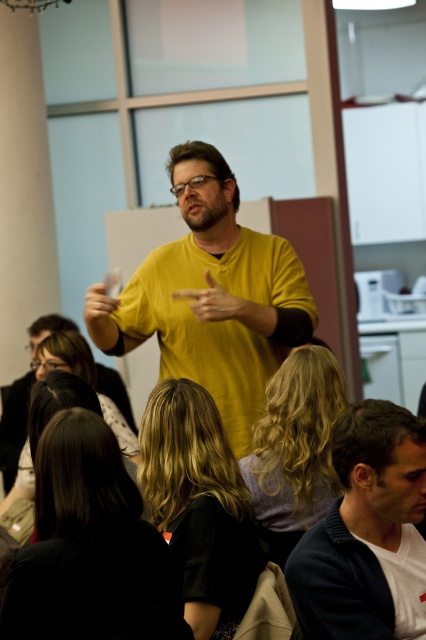
Which of these two, yellow matte shirt at center or dark blue sweater at lower right, stands shorter?

Standing shorter between the two is dark blue sweater at lower right.

Which is behind, point (144, 273) or point (397, 545)?

The point (144, 273) is behind.

Identify the location of yellow matte shirt at center. (210, 296).